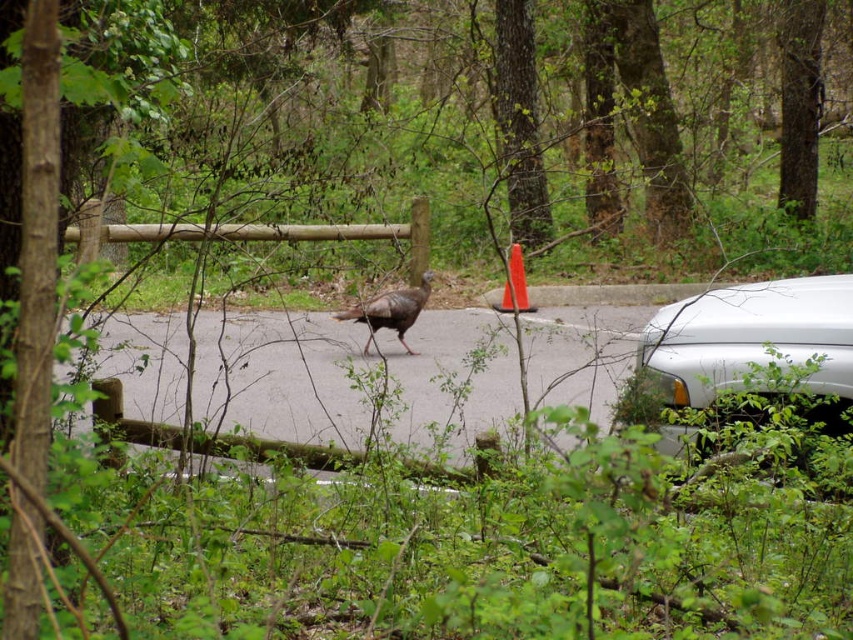
Based on the photo, you are a delivery driver who needs to park your white glossy car at right next to the orange plastic traffic cone at center. Can your car fit in the space next to the cone without overlapping it?

The white glossy car at right is wider than the orange plastic traffic cone at center. Therefore, the car may not fit next to the cone without overlapping it, as the cone is narrower than the car.

You are a photographer trying to capture a clear shot of the brown feathered turkey at center without the white glossy car at right blocking the view. Based on their heights, can you position yourself lower to the ground to avoid the car obstructing the turkey?

The white glossy car at right has a lesser height compared to the brown feathered turkey at center. Since the car is shorter, positioning yourself lower to the ground might still allow the turkey to be visible above the car, avoiding obstruction.

You are a pedestrian standing on the side of the road and see the white glossy car at right and the brown feathered turkey at center. Which object is wider?

The white glossy car at right is wider than the brown feathered turkey at center.